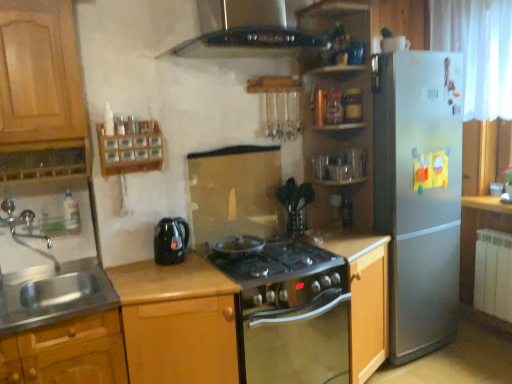
Where is `empty space that is ontop of wooden cabinet at center, which is counted as the second cabinetry, starting from the right (from a real-world perspective)`? This screenshot has width=512, height=384. empty space that is ontop of wooden cabinet at center, which is counted as the second cabinetry, starting from the right (from a real-world perspective) is located at coordinates (175, 277).